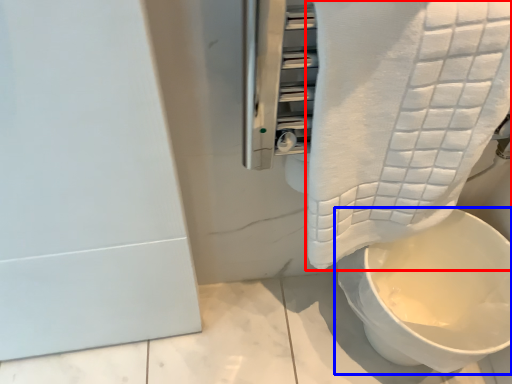
Question: Which object is closer to the camera taking this photo, towel (highlighted by a red box) or toilet (highlighted by a blue box)?

Choices:
 (A) towel
 (B) toilet

Answer: (A)